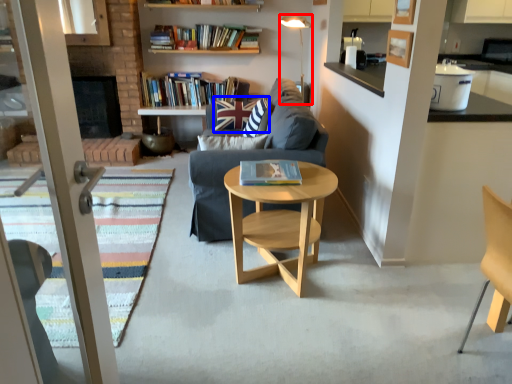
Question: Which of the following is the farthest to the observer, lamp (highlighted by a red box) or pillow (highlighted by a blue box)?

Choices:
 (A) lamp
 (B) pillow

Answer: (A)